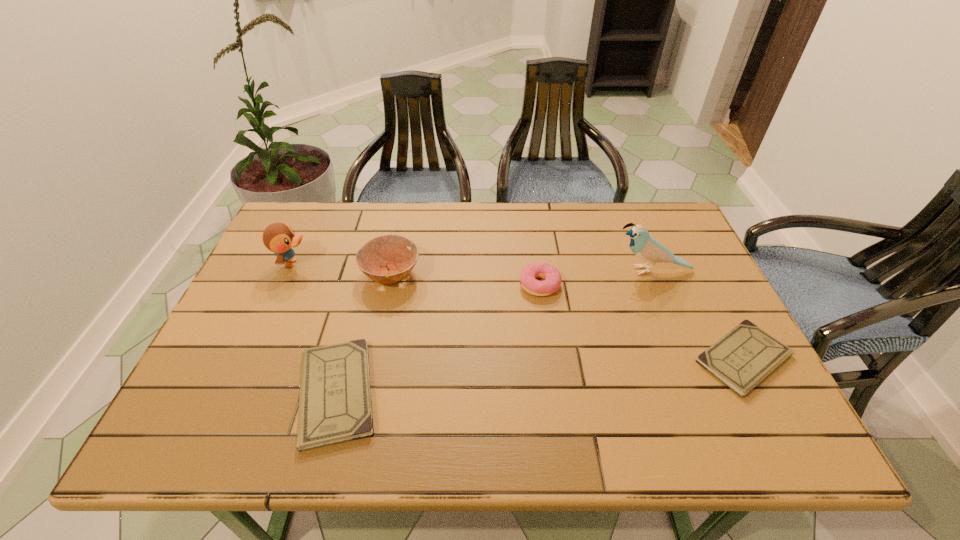
To make them evenly spaced by inserting another checkbook among them, please locate a vacant spot for this new checkbook. Please provide its 2D coordinates. Your answer should be formatted as a tuple, i.e. [(x, y)], where the tuple contains the x and y coordinates of a point satisfying the conditions above.

[(546, 375)]